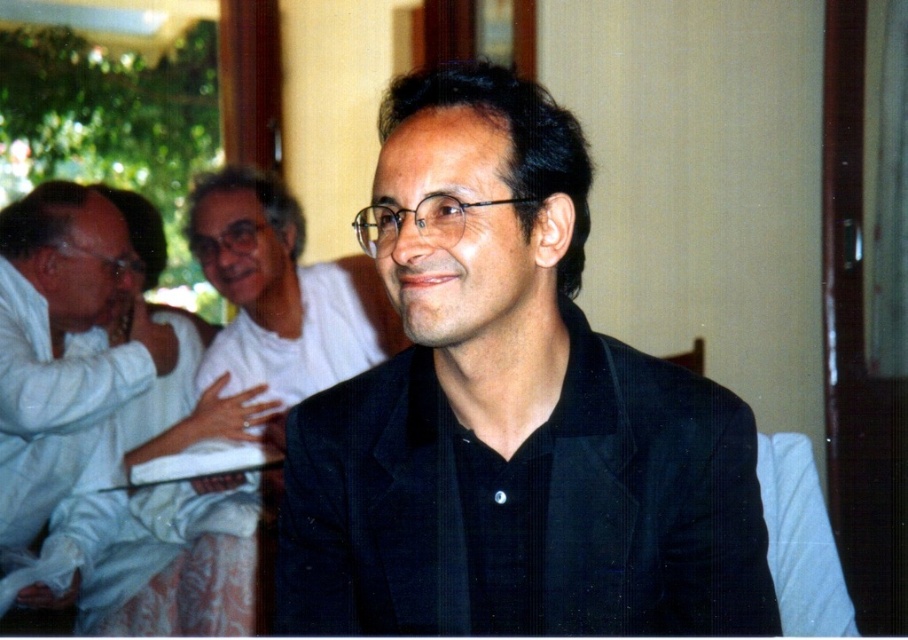
Is black textured suit at center smaller than white cotton shirt at left?

Correct, black textured suit at center occupies less space than white cotton shirt at left.

From the picture: Which is more to the right, black textured suit at center or white cotton shirt at left?

black textured suit at center

Is point (561, 180) less distant than point (47, 448)?

Yes, point (561, 180) is closer to viewer.

Where is `black textured suit at center`? The image size is (908, 640). black textured suit at center is located at coordinates (510, 413).